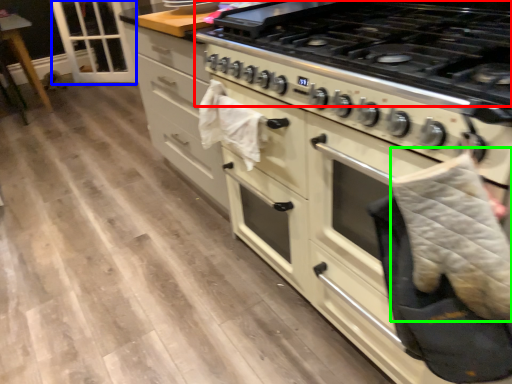
Question: Which object is positioned farthest from gas stove (highlighted by a red box)? Select from glass door (highlighted by a blue box) and blanket (highlighted by a green box).

Choices:
 (A) glass door
 (B) blanket

Answer: (A)